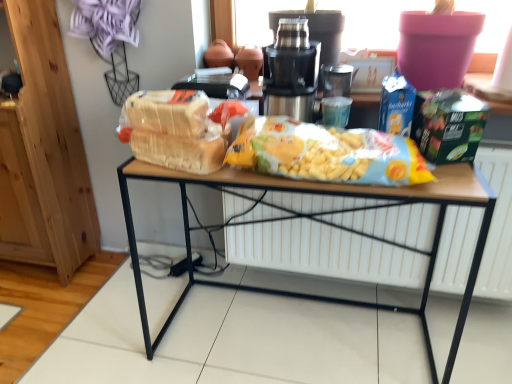
In order to click on free space above light brown bread at center (from a real-world perspective) in this screenshot , I will do `click(158, 129)`.